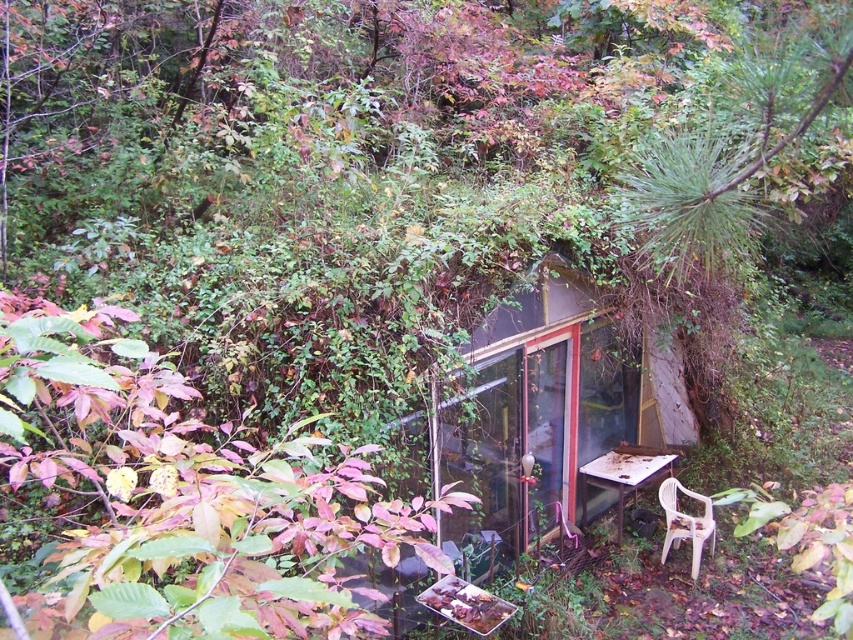
Question: Which point is farther to the camera?

Choices:
 (A) rusty metal table at lower right
 (B) transparent glass hut at center
 (C) white plastic chair at lower right

Answer: (A)

Question: Does rusty metal table at lower right appear under white plastic chair at lower right?

Choices:
 (A) no
 (B) yes

Answer: (A)

Question: Where is rusty metal table at lower right located in relation to white plastic chair at lower right in the image?

Choices:
 (A) below
 (B) above

Answer: (B)

Question: Among these objects, which one is nearest to the camera?

Choices:
 (A) transparent glass hut at center
 (B) white plastic chair at lower right
 (C) rusty metal table at lower right

Answer: (A)

Question: Is transparent glass hut at center thinner than white plastic chair at lower right?

Choices:
 (A) yes
 (B) no

Answer: (B)

Question: Among these points, which one is nearest to the camera?

Choices:
 (A) (607, 461)
 (B) (479, 561)
 (C) (666, 490)

Answer: (B)